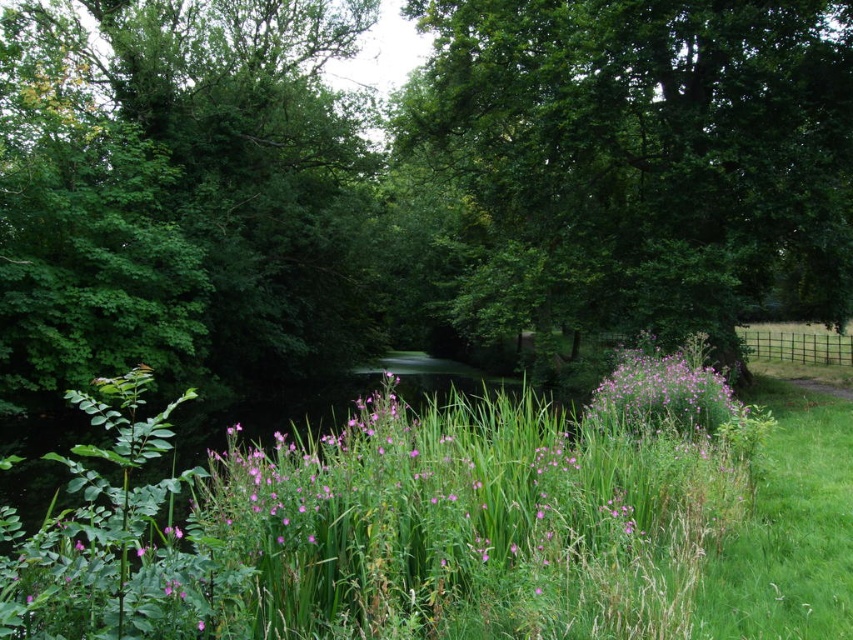
Is point (721, 328) in front of point (550, 451)?

That is False.

You are a GUI agent. You are given a task and a screenshot of the screen. Output one action in this format:
    pyautogui.click(x=<x>, y=<y>)
    Task: Click on the green leafy tree at center
    The image size is (853, 640).
    Given the screenshot: What is the action you would take?
    pyautogui.click(x=646, y=156)

Does point (547, 65) lie in front of point (674, 426)?

No, it is behind (674, 426).

Can you confirm if green leafy tree at center is positioned to the right of purple matte flowers at center-right?

Indeed, green leafy tree at center is positioned on the right side of purple matte flowers at center-right.

Identify the location of green leafy tree at center. (646, 156).

Is purple matte flowers at center-right above pink matte flower at center?

Correct, purple matte flowers at center-right is located above pink matte flower at center.

Can you confirm if purple matte flowers at center-right is smaller than pink matte flower at center?

No.

Describe the element at coordinates (664, 390) in the screenshot. The image size is (853, 640). I see `purple matte flowers at center-right` at that location.

Where is `purple matte flowers at center-right`? The image size is (853, 640). purple matte flowers at center-right is located at coordinates (664, 390).